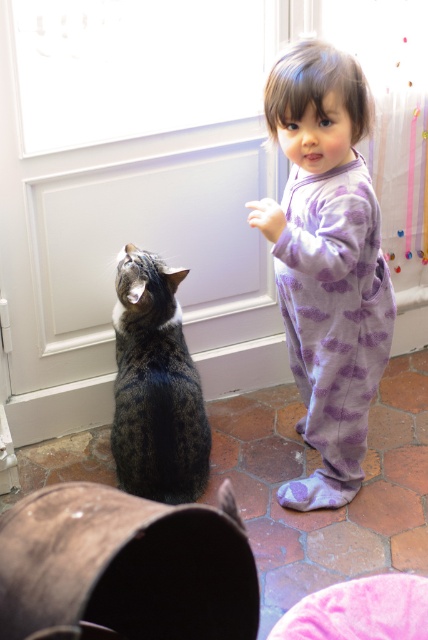
Does point (353, 243) come behind point (139, 273)?

That is False.

Between point (344, 116) and point (177, 356), which one is positioned behind?

Point (177, 356)

This screenshot has height=640, width=428. Find the location of `purple fleece onesie at center`. purple fleece onesie at center is located at coordinates (326, 262).

Who is lower down, white glossy screen door at center or purple fleece onesie at center?

purple fleece onesie at center is lower down.

Does point (48, 42) lie in front of point (321, 474)?

Yes, it is in front of point (321, 474).

The image size is (428, 640). What are the coordinates of `white glossy screen door at center` in the screenshot? It's located at (136, 176).

Based on the photo, is white glossy screen door at center thinner than tabby fur cat at lower left?

No.

This screenshot has width=428, height=640. I want to click on white glossy screen door at center, so click(x=136, y=176).